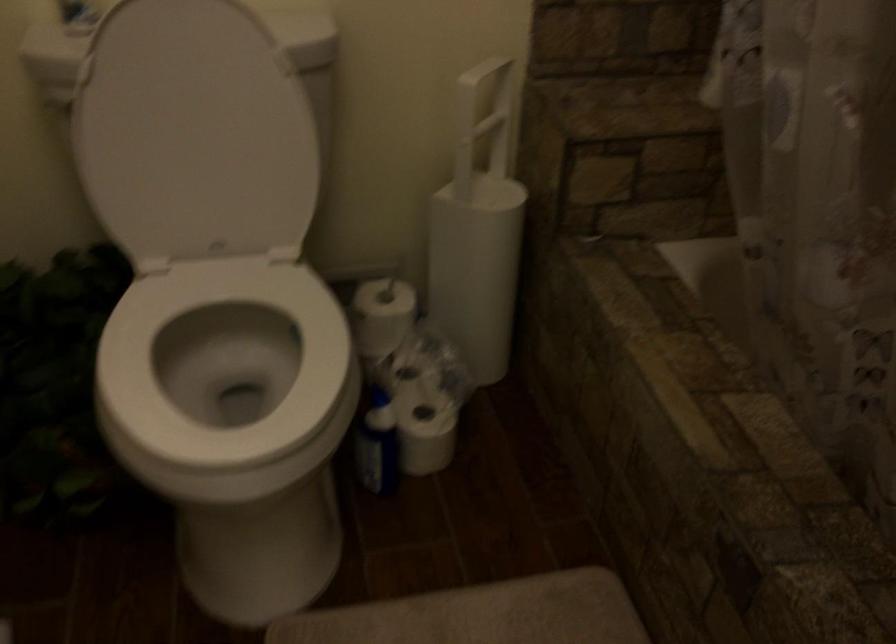
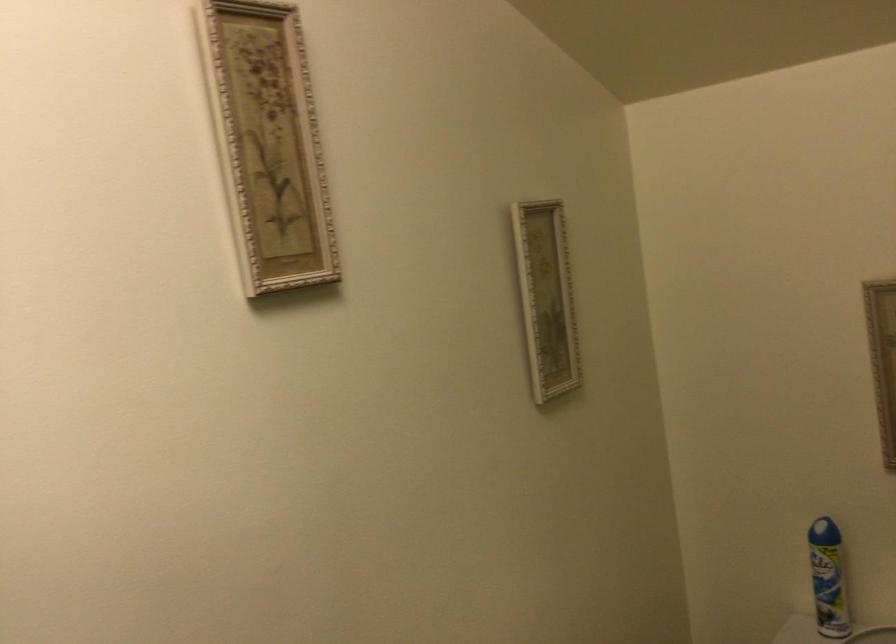
The images are taken continuously from a first-person perspective. In which direction is your viewpoint rotating?

The camera's rotation is toward left-up.